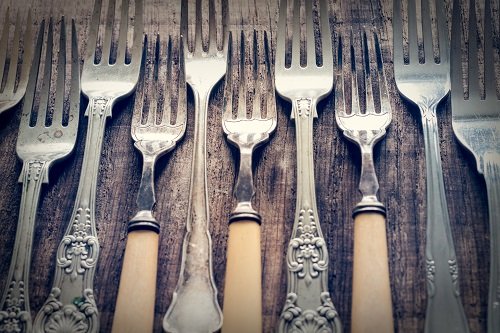
Where is `small forks`? small forks is located at coordinates (154, 140), (254, 130), (354, 127).